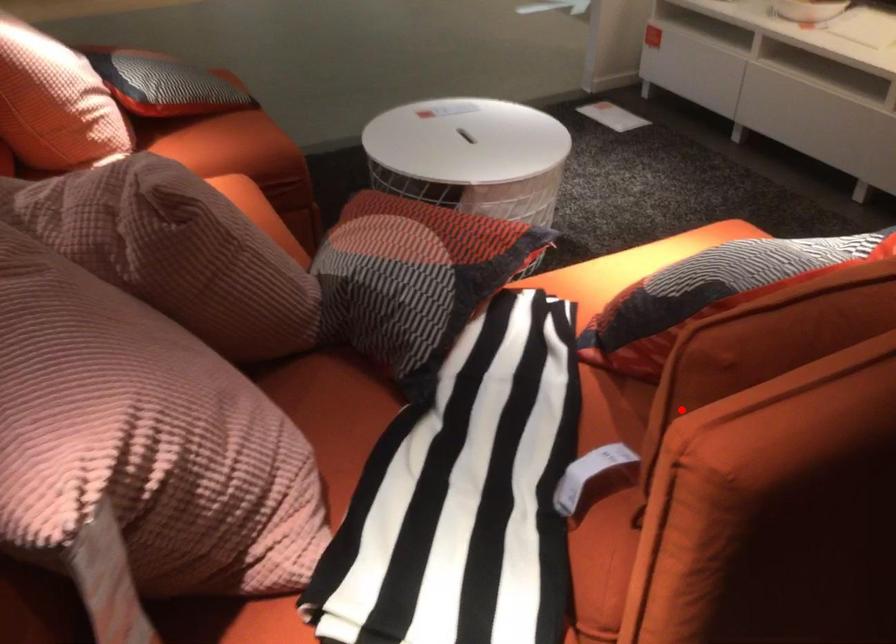
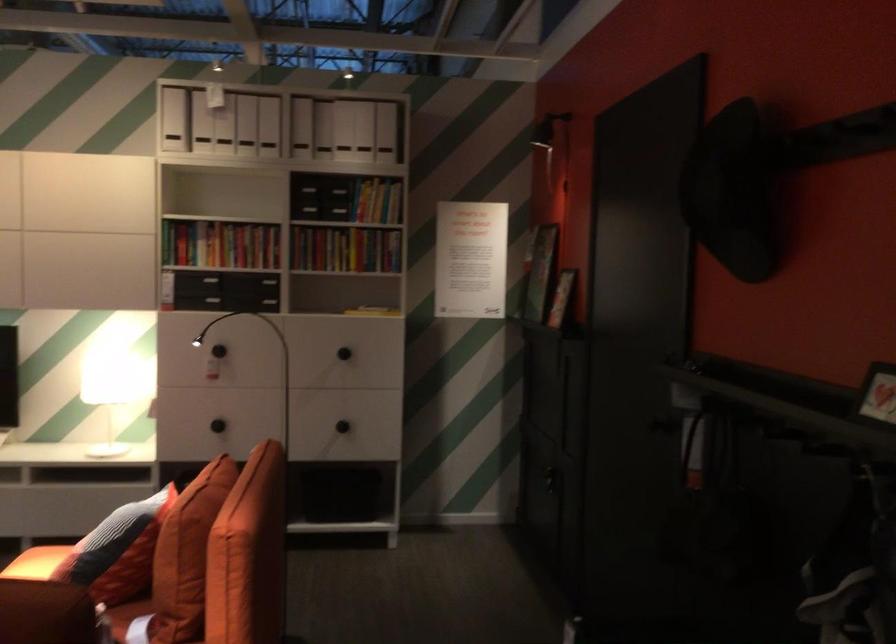
Question: I am providing you with two images of the same scene from different viewpoints. Image1 has a red point marked. In image2, the corresponding 3D location appears at what relative position? Reply with the corresponding letter.

Choices:
 (A) Closer
 (B) Farther

Answer: (B)